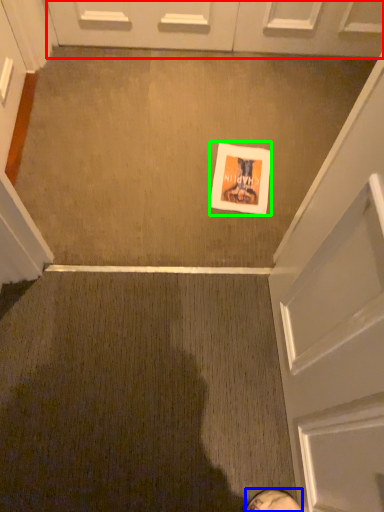
Question: Considering the real-world distances, which object is farthest from door (highlighted by a red box)? footwear (highlighted by a blue box) or flyer (highlighted by a green box)?

Choices:
 (A) footwear
 (B) flyer

Answer: (A)